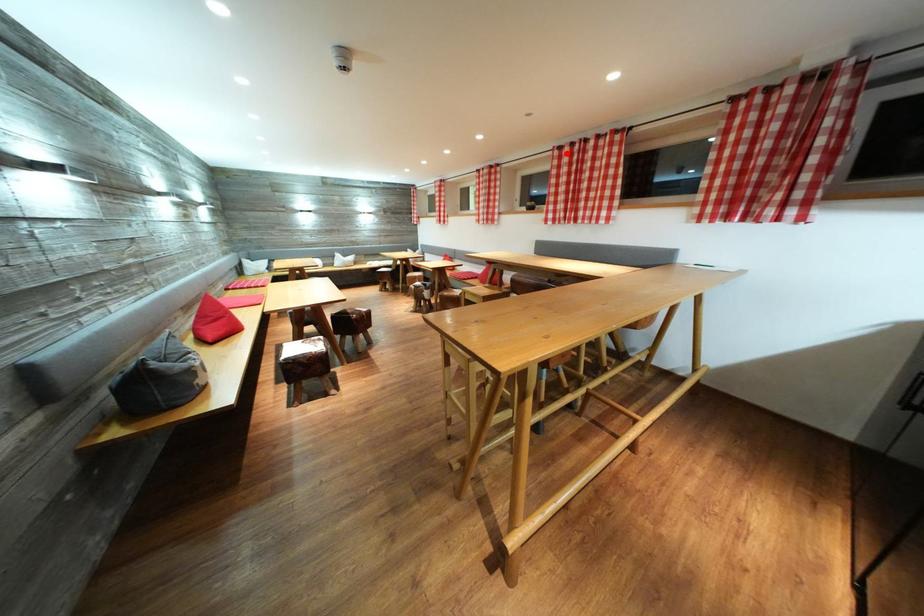
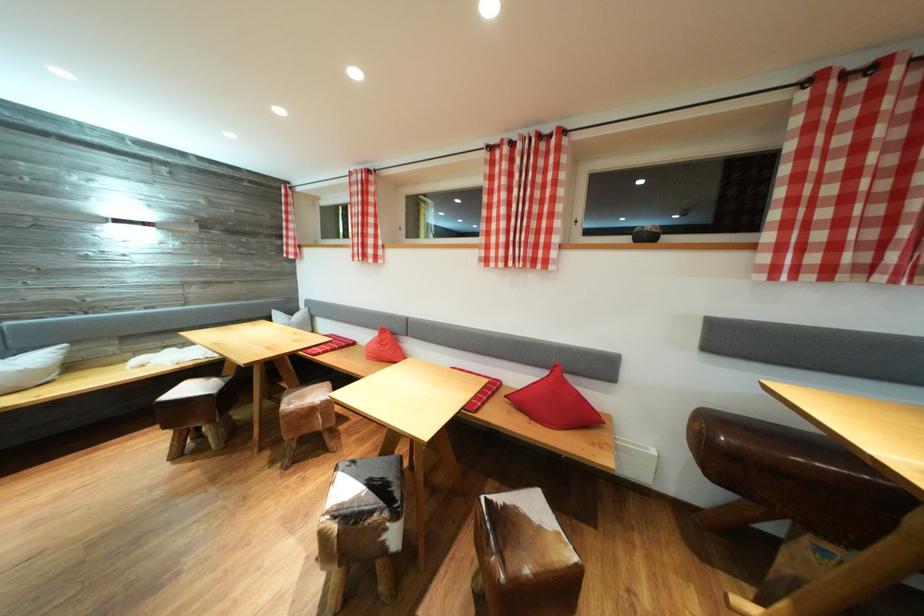
Locate, in the second image, the point that corresponds to the highlighted location in the first image.

(852, 81)